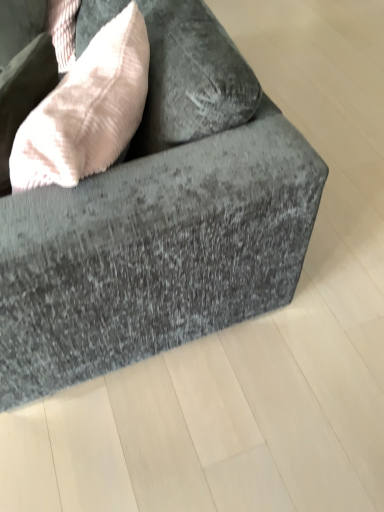
Question: From the image's perspective, is velvet gray couch at center above or below light pink textured throw pillow at upper left?

Choices:
 (A) above
 (B) below

Answer: (A)

Question: Relative to light pink textured throw pillow at upper left, is velvet gray couch at center in front or behind?

Choices:
 (A) behind
 (B) front

Answer: (B)

Question: Looking at their shapes, would you say velvet gray couch at center is wider or thinner than light pink textured throw pillow at upper left?

Choices:
 (A) thin
 (B) wide

Answer: (B)

Question: Is light pink textured throw pillow at upper left wider or thinner than velvet gray couch at center?

Choices:
 (A) wide
 (B) thin

Answer: (B)

Question: Considering their positions, is light pink textured throw pillow at upper left located in front of or behind velvet gray couch at center?

Choices:
 (A) behind
 (B) front

Answer: (A)

Question: Would you say light pink textured throw pillow at upper left is inside or outside velvet gray couch at center?

Choices:
 (A) outside
 (B) inside

Answer: (B)

Question: From a real-world perspective, is light pink textured throw pillow at upper left physically located above or below velvet gray couch at center?

Choices:
 (A) below
 (B) above

Answer: (B)